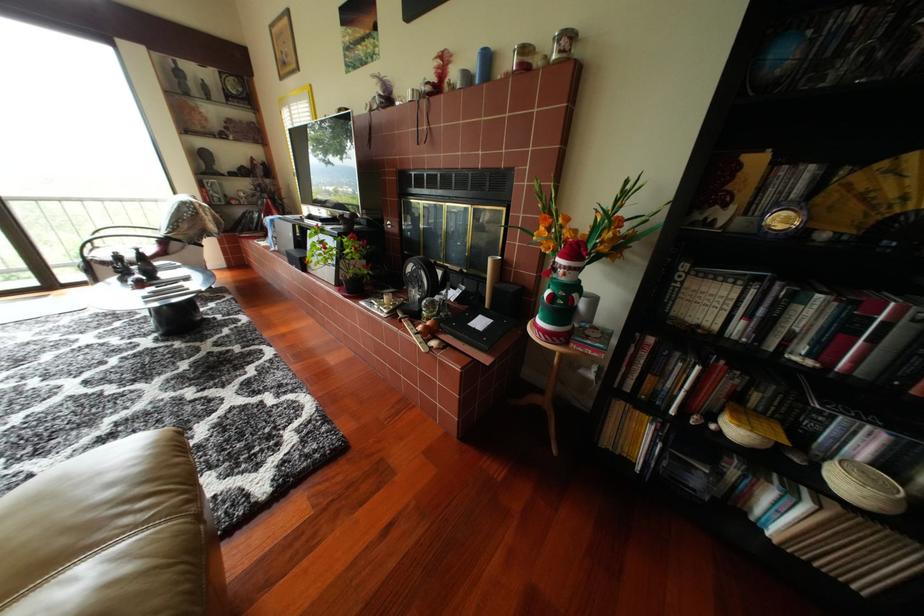
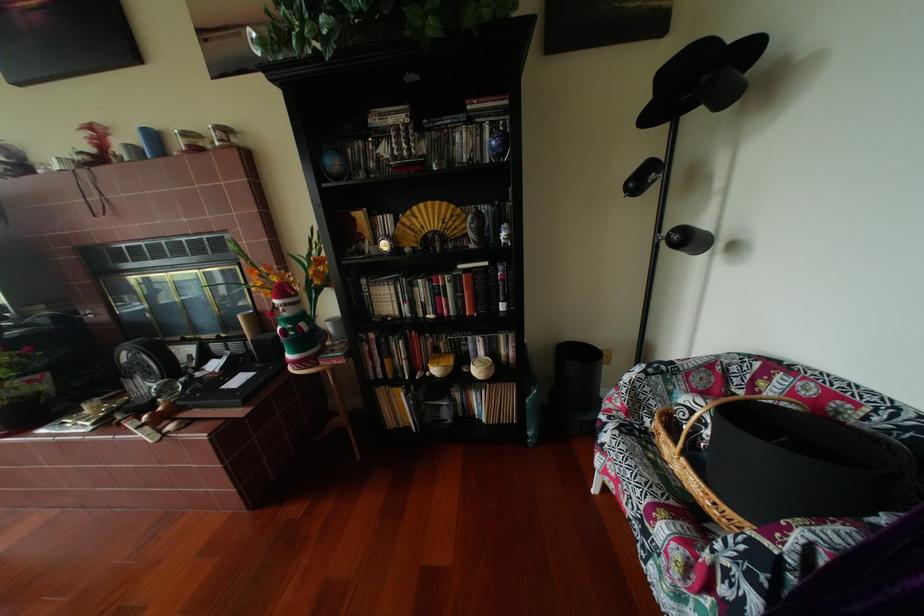
The point at [574,272] is marked in the first image. Where is the corresponding point in the second image?

(294, 310)